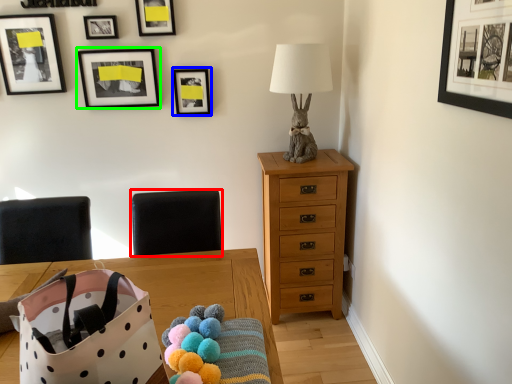
Question: Which object is positioned closest to armchair (highlighted by a red box)? Select from picture frame (highlighted by a blue box) and picture frame (highlighted by a green box).

Choices:
 (A) picture frame
 (B) picture frame

Answer: (A)